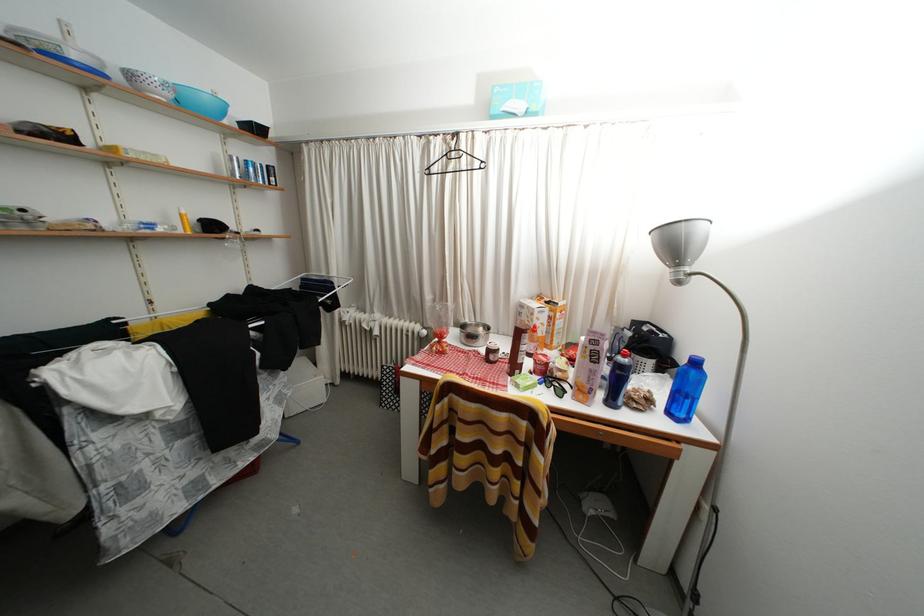
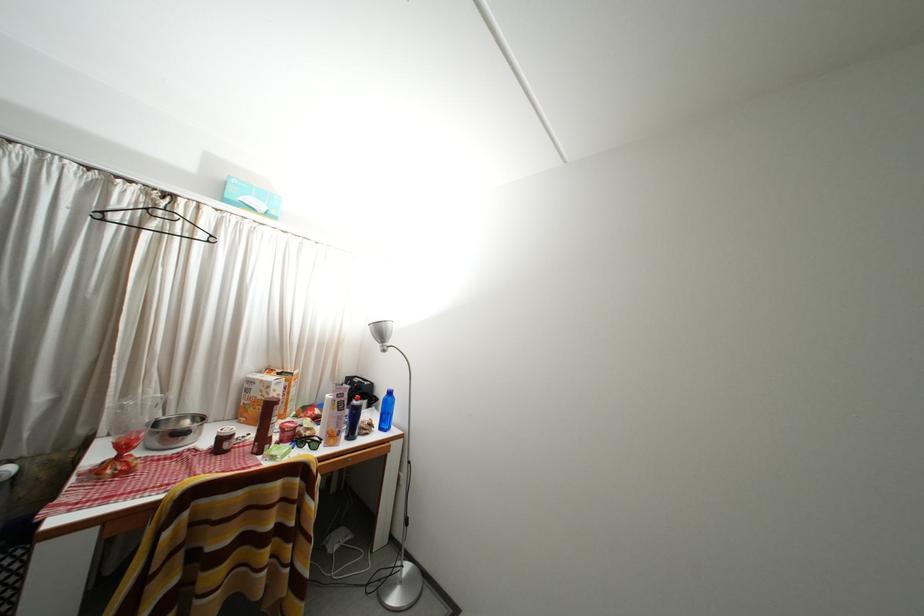
Where in the second image is the point corresponding to (x=496, y=357) from the first image?

(229, 445)